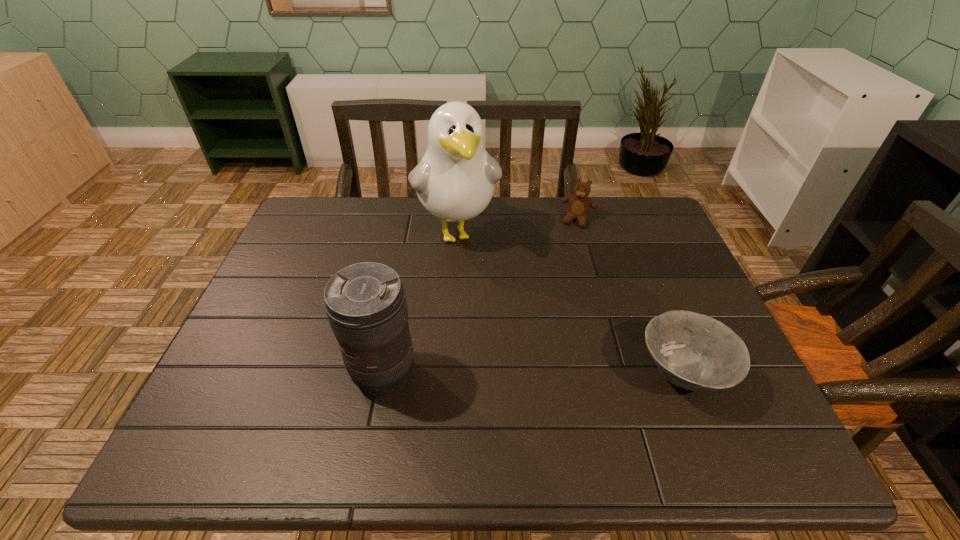
The height and width of the screenshot is (540, 960). Find the location of `free point at the right edge`. free point at the right edge is located at coordinates (657, 271).

Identify the location of vacant space at the near left corner of the desktop. (249, 391).

Identify the location of vacant space at the far right corner of the desktop. click(x=615, y=218).

Locate an element on the screen. free area in between the teddy bear and the shortest object is located at coordinates (630, 298).

Locate an element on the screen. This screenshot has height=540, width=960. vacant area that lies between the teddy bear and the gull is located at coordinates (518, 226).

The width and height of the screenshot is (960, 540). Identify the location of unoccupied position between the second tallest object and the teddy bear. (481, 298).

At what (x,y) coordinates should I click in order to perform the action: click on free space between the telephoto lens and the shortest object. Please return your answer as a coordinate pair (x, y). The height and width of the screenshot is (540, 960). Looking at the image, I should click on (533, 375).

Where is `free space between the telephoto lens and the tallest object`? This screenshot has height=540, width=960. free space between the telephoto lens and the tallest object is located at coordinates click(420, 303).

This screenshot has width=960, height=540. Identify the location of free space between the teddy bear and the telephoto lens. (481, 298).

Locate an element on the screen. free area in between the gull and the telephoto lens is located at coordinates (420, 303).